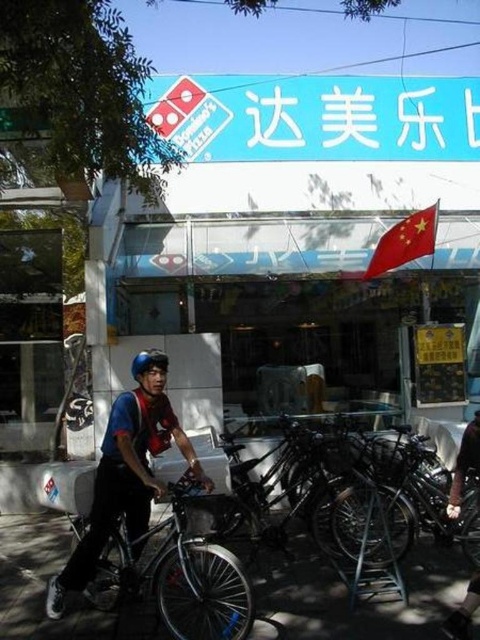
Question: Does red helmet at center have a lesser width compared to silver metallic bicycle at center?

Choices:
 (A) no
 (B) yes

Answer: (B)

Question: Among these objects, which one is farthest from the camera?

Choices:
 (A) shiny metallic bicycle at center
 (B) silver metallic bicycle at center
 (C) red helmet at center
 (D) matte blue helmet at center

Answer: (A)

Question: From the image, what is the correct spatial relationship of shiny metallic bicycle at center in relation to red helmet at center?

Choices:
 (A) above
 (B) below

Answer: (B)

Question: Considering the relative positions of red helmet at center and silver metallic bicycle at center in the image provided, where is red helmet at center located with respect to silver metallic bicycle at center?

Choices:
 (A) below
 (B) above

Answer: (B)

Question: Which point is farther to the camera?

Choices:
 (A) matte blue helmet at center
 (B) red helmet at center
 (C) silver metallic bicycle at center

Answer: (A)

Question: Which point appears farthest from the camera in this image?

Choices:
 (A) (133, 358)
 (B) (120, 566)
 (C) (361, 499)
 (D) (112, 472)

Answer: (A)